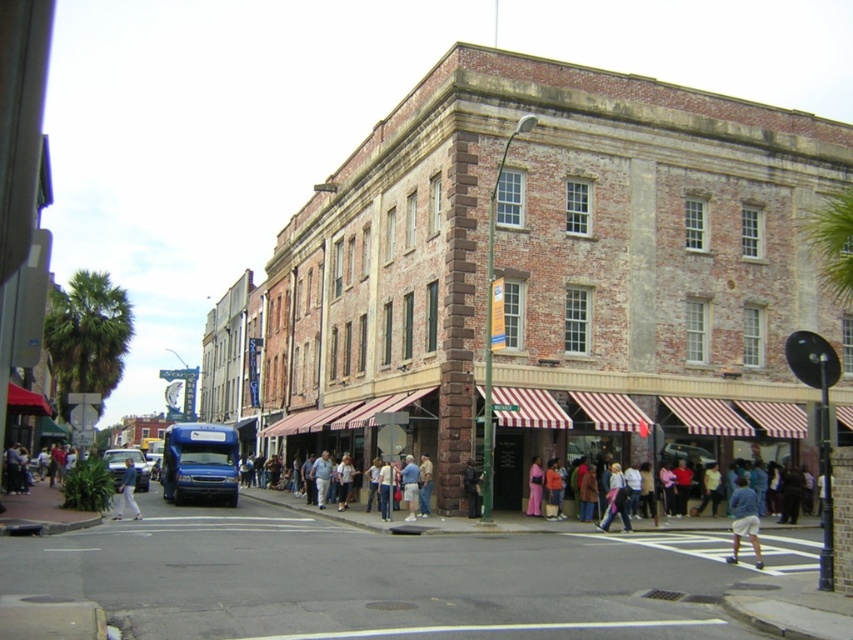
Question: Is light blue jeans at lower left to the left of pink satin dress at center from the viewer's perspective?

Choices:
 (A) no
 (B) yes

Answer: (B)

Question: Does denim jacket at lower center have a greater width compared to pink satin dress at center?

Choices:
 (A) no
 (B) yes

Answer: (A)

Question: Does blue denim shorts at lower right appear on the right side of light blue jeans at lower left?

Choices:
 (A) yes
 (B) no

Answer: (A)

Question: Which of the following is the farthest from the observer?

Choices:
 (A) (741, 509)
 (B) (403, 496)
 (C) (537, 477)

Answer: (C)

Question: Which object is the farthest from the light blue jeans at lower left?

Choices:
 (A) denim jacket at lower center
 (B) pink satin dress at center

Answer: (B)

Question: Which is farther from the denim jacket at lower center?

Choices:
 (A) pink satin dress at center
 (B) light blue jeans at lower left
 (C) light blue jeans at lower center
 (D) blue denim shorts at lower right

Answer: (D)